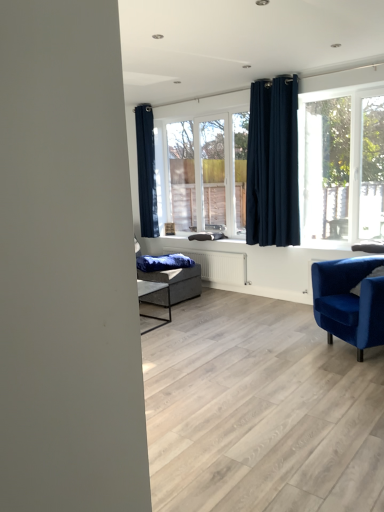
Question: Is clear glass window at center taller than velvet blue armchair at lower right?

Choices:
 (A) no
 (B) yes

Answer: (B)

Question: Is clear glass window at center bigger than velvet blue armchair at lower right?

Choices:
 (A) yes
 (B) no

Answer: (B)

Question: Are clear glass window at center and velvet blue armchair at lower right far apart?

Choices:
 (A) yes
 (B) no

Answer: (A)

Question: Is clear glass window at center thinner than velvet blue armchair at lower right?

Choices:
 (A) yes
 (B) no

Answer: (A)

Question: Does clear glass window at center come behind velvet blue armchair at lower right?

Choices:
 (A) yes
 (B) no

Answer: (A)

Question: Is clear glass window at center to the left or to the right of blue velvet blanket at center in the image?

Choices:
 (A) left
 (B) right

Answer: (B)

Question: Is point (243, 161) positioned closer to the camera than point (190, 258)?

Choices:
 (A) farther
 (B) closer

Answer: (B)

Question: From a real-world perspective, is clear glass window at center above or below blue velvet blanket at center?

Choices:
 (A) below
 (B) above

Answer: (B)

Question: From the image's perspective, is clear glass window at center positioned above or below blue velvet blanket at center?

Choices:
 (A) below
 (B) above

Answer: (B)

Question: Considering the positions of point (231, 207) and point (147, 224), is point (231, 207) closer or farther from the camera than point (147, 224)?

Choices:
 (A) closer
 (B) farther

Answer: (A)

Question: Visually, is clear glass window at center positioned to the left or to the right of dark blue fabric curtain at upper left, arranged as the 2th curtain when viewed from the right?

Choices:
 (A) left
 (B) right

Answer: (B)

Question: In the image, is clear glass window at center positioned in front of or behind dark blue fabric curtain at upper left, which ranks as the first curtain in back-to-front order?

Choices:
 (A) front
 (B) behind

Answer: (A)

Question: Looking at the image, does clear glass window at center seem bigger or smaller compared to dark blue fabric curtain at upper left, which ranks as the first curtain in back-to-front order?

Choices:
 (A) small
 (B) big

Answer: (B)

Question: Is point (158, 266) closer or farther from the camera than point (147, 212)?

Choices:
 (A) closer
 (B) farther

Answer: (A)

Question: From their relative heights in the image, would you say blue velvet blanket at center is taller or shorter than dark blue fabric curtain at upper left, which appears as the second curtain when viewed from the front?

Choices:
 (A) tall
 (B) short

Answer: (B)